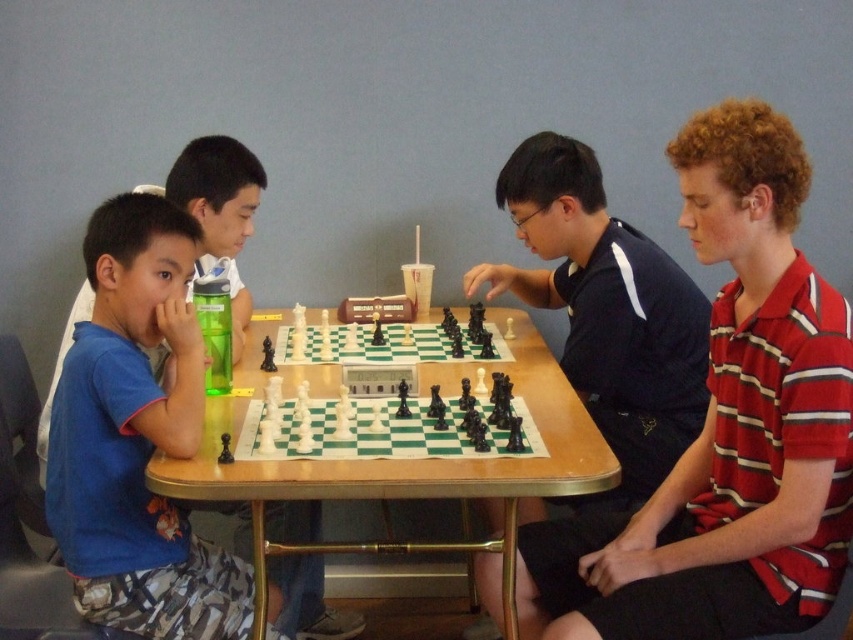
Question: Estimate the real-world distances between objects in this image. Which object is farther from the wooden at center?

Choices:
 (A) blue fabric shirt at left
 (B) striped cotton shirt at right
 (C) matte blue shirt at left

Answer: (A)

Question: Which point is closer to the camera?

Choices:
 (A) (645, 460)
 (B) (699, 230)
 (C) (231, 182)

Answer: (B)

Question: Does wooden at center have a greater width compared to white plastic chess set at center?

Choices:
 (A) no
 (B) yes

Answer: (B)

Question: Is matte blue shirt at left bigger than wooden at center?

Choices:
 (A) no
 (B) yes

Answer: (A)

Question: Is striped cotton shirt at right above black glossy chess piece at center?

Choices:
 (A) yes
 (B) no

Answer: (B)

Question: Which of the following is the closest to the observer?

Choices:
 (A) (641, 595)
 (B) (213, 150)
 (C) (508, 348)
 (D) (161, 560)

Answer: (A)